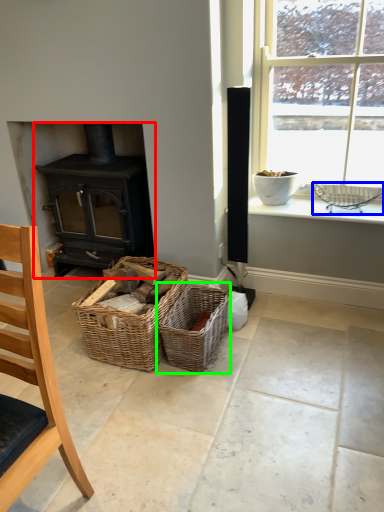
Question: Which object is the closest to the wood burning stove (highlighted by a red box)? Choose among these: basket (highlighted by a blue box) or picnic basket (highlighted by a green box).

Choices:
 (A) basket
 (B) picnic basket

Answer: (B)